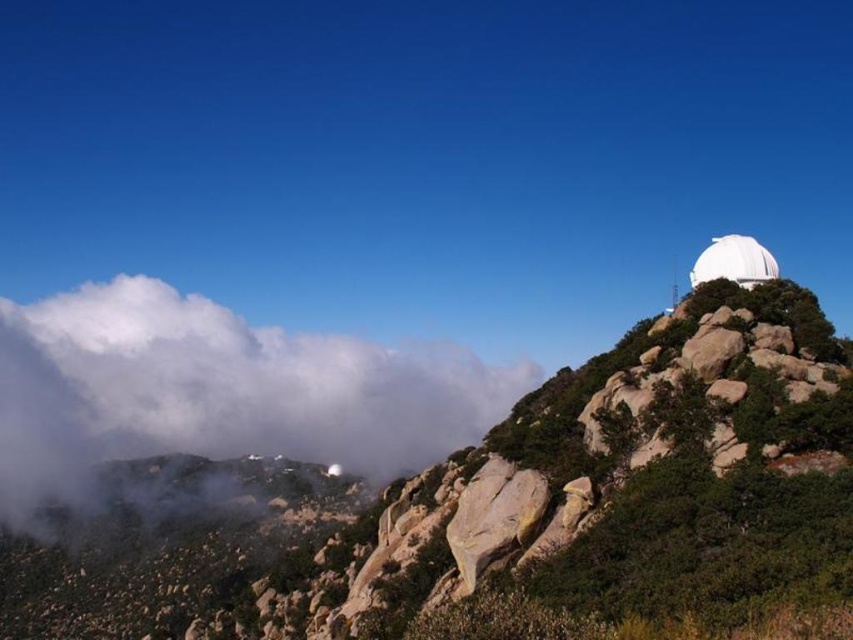
Question: Does smooth granite mountain at upper right appear over white fluffy cloud at upper left?

Choices:
 (A) no
 (B) yes

Answer: (A)

Question: Considering the real-world distances, which object is farthest from the white matte dome at upper right?

Choices:
 (A) white fluffy cloud at upper left
 (B) smooth granite mountain at upper right

Answer: (A)

Question: Which point is farther from the camera taking this photo?

Choices:
 (A) (712, 616)
 (B) (123, 365)

Answer: (B)

Question: Does smooth granite mountain at upper right appear over white fluffy cloud at upper left?

Choices:
 (A) yes
 (B) no

Answer: (B)

Question: Is white fluffy cloud at upper left thinner than white matte dome at upper right?

Choices:
 (A) no
 (B) yes

Answer: (A)

Question: Which point is closer to the camera?

Choices:
 (A) smooth granite mountain at upper right
 (B) white fluffy cloud at upper left

Answer: (A)